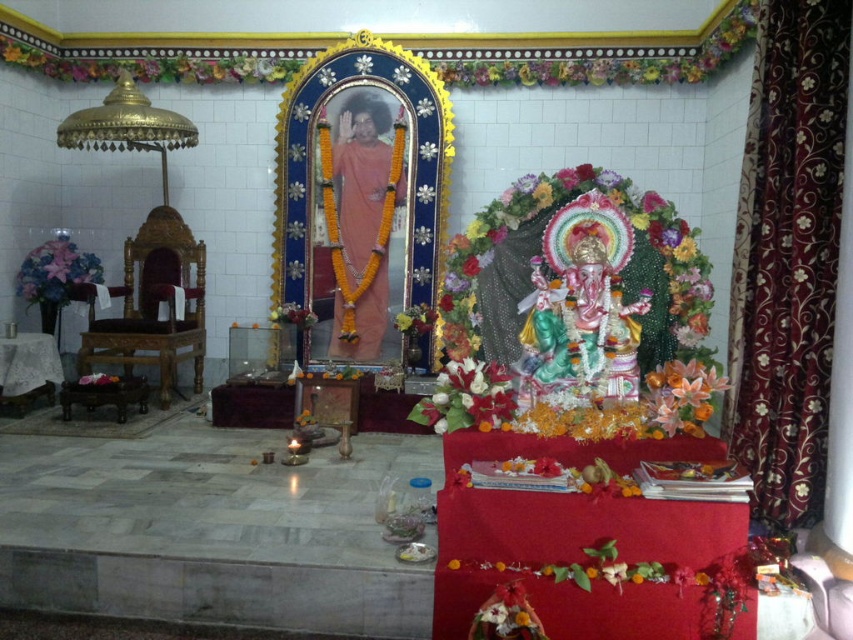
Question: Which of the following is the farthest from the observer?

Choices:
 (A) floral bouquet at center
 (B) matte pink statue at center

Answer: (B)

Question: Is floral garland at center positioned in front of orange silk flower at lower right?

Choices:
 (A) no
 (B) yes

Answer: (A)

Question: Which object is positioned closest to the matte pink statue at center?

Choices:
 (A) floral bouquet at center
 (B) floral garland at center
 (C) silky purple fabric at left

Answer: (C)

Question: Is floral garland at center further to the viewer compared to matte pink statue at center?

Choices:
 (A) no
 (B) yes

Answer: (A)

Question: Which of the following is the closest to the observer?

Choices:
 (A) (695, 362)
 (B) (453, 368)
 (C) (67, 272)

Answer: (A)

Question: Can you confirm if floral bouquet at center is positioned to the left of orange silk flower at lower right?

Choices:
 (A) no
 (B) yes

Answer: (B)